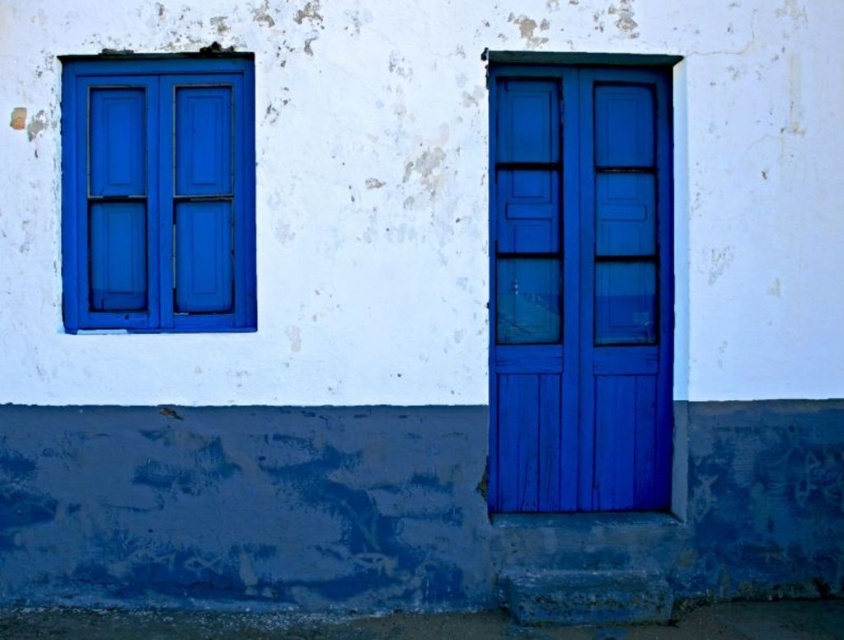
Which is below, matte wood door at right or matte blue window at upper left?

matte wood door at right is lower down.

Who is more forward, (501, 179) or (122, 212)?

Positioned in front is point (122, 212).

Is point (610, 129) closer to camera compared to point (247, 116)?

No, (610, 129) is behind (247, 116).

You are a GUI agent. You are given a task and a screenshot of the screen. Output one action in this format:
    pyautogui.click(x=<x>, y=<y>)
    Task: Click on the matte wood door at right
    The height and width of the screenshot is (640, 844).
    Given the screenshot: What is the action you would take?
    pyautogui.click(x=579, y=282)